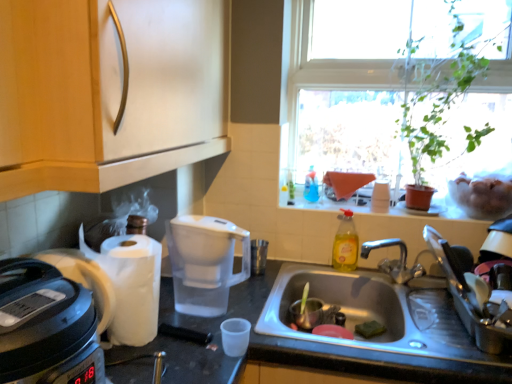
The height and width of the screenshot is (384, 512). I want to click on vacant space positioned to the left of yellow translucent bottle at sink, marked as the 2th bottle in a left-to-right arrangement, so click(x=320, y=267).